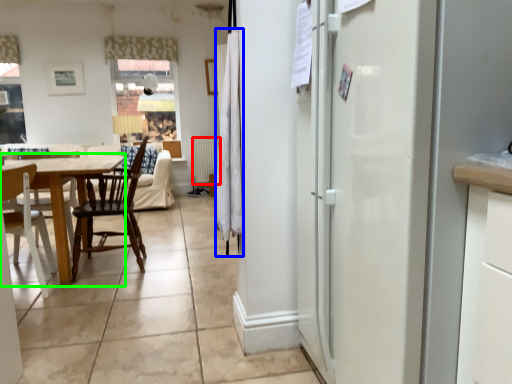
Question: Which object is positioned farthest from radiator (highlighted by a red box)? Select from curtain (highlighted by a blue box) and table (highlighted by a green box).

Choices:
 (A) curtain
 (B) table

Answer: (A)